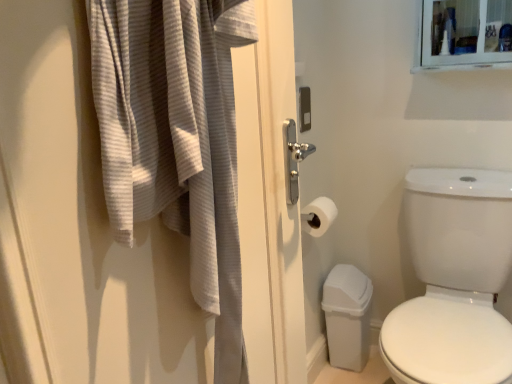
This screenshot has height=384, width=512. I want to click on white matte toilet paper at center, so click(318, 216).

At what (x,y) coordinates should I click in order to perform the action: click on white matte toilet paper at center. Please return your answer as a coordinate pair (x, y). Looking at the image, I should click on tap(318, 216).

Are white matte toilet paper at center and white glossy toilet at right located far from each other?

That's not correct — white matte toilet paper at center is a little close to white glossy toilet at right.

This screenshot has height=384, width=512. I want to click on toilet bowl that appears below the white matte toilet paper at center (from the image's perspective), so click(454, 280).

Can you tell me how much white matte toilet paper at center and white glossy toilet at right differ in facing direction?

There is a 89.9-degree angle between the facing directions of white matte toilet paper at center and white glossy toilet at right.

Considering the sizes of objects white matte toilet paper at center and white glossy toilet at right in the image provided, who is bigger, white matte toilet paper at center or white glossy toilet at right?

Bigger between the two is white glossy toilet at right.

Is point (117, 215) less distant than point (331, 207)?

Yes.

Which object is closer to the camera taking this photo, gray textured bath towel at left or white matte toilet paper at center?

gray textured bath towel at left is closer to the camera.

Can you confirm if gray textured bath towel at left is bigger than white matte toilet paper at center?

Correct, gray textured bath towel at left is larger in size than white matte toilet paper at center.

Could you tell me if gray textured bath towel at left is facing white matte toilet paper at center?

No, gray textured bath towel at left is not turned towards white matte toilet paper at center.

Is gray textured bath towel at left smaller than white glossy toilet at right?

Yes, gray textured bath towel at left is smaller than white glossy toilet at right.

Can white glossy toilet at right be found inside gray textured bath towel at left?

No.

Between gray textured bath towel at left and white glossy toilet at right, which one has less height?

With less height is gray textured bath towel at left.

Considering the positions of objects gray textured bath towel at left and white glossy toilet at right in the image provided, who is behind, gray textured bath towel at left or white glossy toilet at right?

white glossy toilet at right is further from the camera.

Consider the image. From the image's perspective, which one is positioned higher, white glossy toilet at right or gray textured bath towel at left?

From the image's view, gray textured bath towel at left is above.

Find the location of a particular element. The image size is (512, 384). bath towel that appears above the white glossy toilet at right (from a real-world perspective) is located at coordinates 176,139.

Is white glossy toilet at right wider or thinner than gray textured bath towel at left?

Clearly, white glossy toilet at right has more width compared to gray textured bath towel at left.

Is white glossy toilet at right not close to gray textured bath towel at left?

No.

From the image's perspective, is white matte toilet paper at center located above gray textured bath towel at left?

Incorrect, from the image's perspective, white matte toilet paper at center is lower than gray textured bath towel at left.

Is gray textured bath towel at left a part of white matte toilet paper at center?

No, gray textured bath towel at left is not surrounded by white matte toilet paper at center.

This screenshot has height=384, width=512. Find the location of `bath towel to the left of white matte toilet paper at center`. bath towel to the left of white matte toilet paper at center is located at coordinates (176, 139).

Looking at the image, does white matte toilet paper at center seem bigger or smaller compared to gray textured bath towel at left?

Considering their sizes, white matte toilet paper at center takes up less space than gray textured bath towel at left.

Considering the relative sizes of white glossy toilet at right and white matte toilet paper at center in the image provided, is white glossy toilet at right taller than white matte toilet paper at center?

Indeed, white glossy toilet at right has a greater height compared to white matte toilet paper at center.

Considering the sizes of objects white glossy toilet at right and white matte toilet paper at center in the image provided, who is wider, white glossy toilet at right or white matte toilet paper at center?

white glossy toilet at right is wider.

From a real-world perspective, is white glossy toilet at right under white matte toilet paper at center?

Yes.

How different are the orientations of white glossy toilet at right and white matte toilet paper at center in degrees?

white glossy toilet at right and white matte toilet paper at center are facing 89.9 degrees away from each other.

At what (x,y) coordinates should I click in order to perform the action: click on toilet paper above the white glossy toilet at right (from the image's perspective). Please return your answer as a coordinate pair (x, y). Looking at the image, I should click on (318, 216).

The width and height of the screenshot is (512, 384). Find the location of `toilet paper below the gray textured bath towel at left (from a real-world perspective)`. toilet paper below the gray textured bath towel at left (from a real-world perspective) is located at coordinates click(x=318, y=216).

When comparing their distances from gray textured bath towel at left, does white matte toilet paper at center or white glossy toilet at right seem closer?

white matte toilet paper at center is closer to gray textured bath towel at left.

Looking at this image, estimate the real-world distances between objects in this image. Which object is further from white matte toilet paper at center, white glossy toilet at right or gray textured bath towel at left?

Among the two, gray textured bath towel at left is located further to white matte toilet paper at center.

From the picture: Estimate the real-world distances between objects in this image. Which object is further from white matte toilet paper at center, gray textured bath towel at left or white glossy toilet at right?

gray textured bath towel at left lies further to white matte toilet paper at center than the other object.

Considering their positions, is gray textured bath towel at left positioned further to white glossy toilet at right than white matte toilet paper at center?

gray textured bath towel at left is positioned further to the anchor white glossy toilet at right.

Looking at the image, which one is located further to gray textured bath towel at left, white glossy toilet at right or white matte toilet paper at center?

white glossy toilet at right is further to gray textured bath towel at left.

From the image, which object appears to be nearer to white glossy toilet at right, white matte toilet paper at center or gray textured bath towel at left?

Based on the image, white matte toilet paper at center appears to be nearer to white glossy toilet at right.

This screenshot has width=512, height=384. In order to click on toilet bowl positioned between gray textured bath towel at left and white matte toilet paper at center from near to far in this screenshot , I will do `click(454, 280)`.